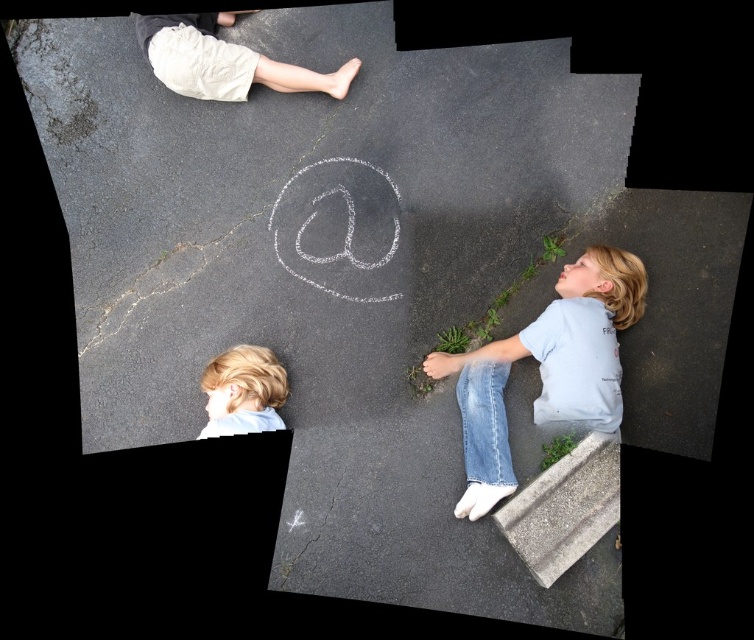
Looking at this image, you are a photographer trying to capture a photo of the light blue denim jeans at lower right and the light beige shorts at upper left. Which object should you focus on first if you want to ensure both are in the frame without moving the camera?

You should focus on the light beige shorts at upper left first because the light blue denim jeans at lower right is below it, so adjusting focus from top to bottom will include both in the frame.

You are a photographer trying to capture a photo of the gray concrete curb at lower right and the light beige shorts at upper left. Which object should you focus on first to ensure both are in sharp focus?

You should focus on the gray concrete curb at lower right first because it is closer to the viewer than the light beige shorts at upper left. By focusing on the closer object, the farther object may still be within the depth of field, ensuring both are in focus.

You are a photographer trying to capture a photo of the light blue denim jeans at lower right and the light beige shorts at upper left. Since you want both items to appear the same size in the photo, which object should you move closer to the camera and which should you move farther away?

The light blue denim jeans at lower right is larger in size than the light beige shorts at upper left. To make them appear the same size in the photo, move the light beige shorts at upper left closer to the camera and move the light blue denim jeans at lower right farther away.